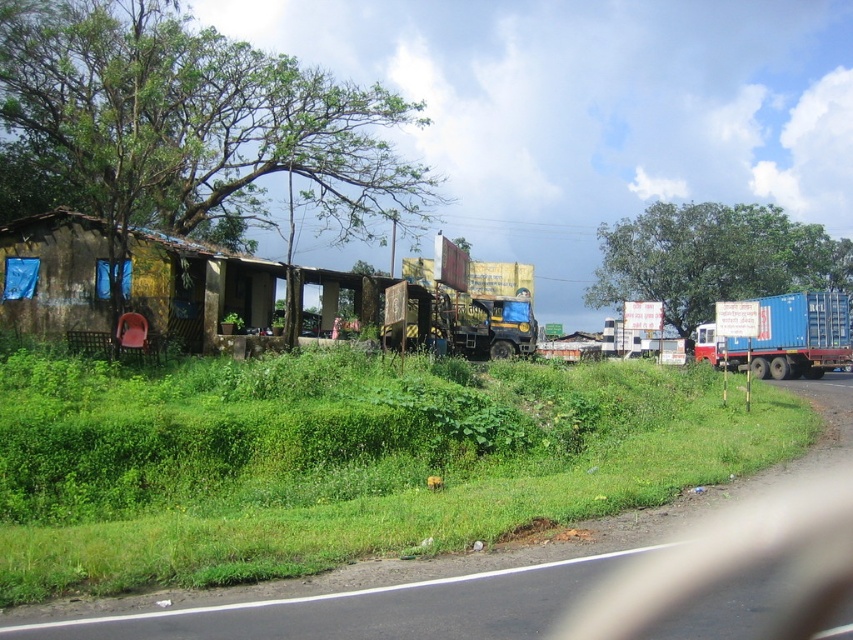
You are driving a delivery truck that is 22 feet long. You need to park your truck between the rusty corrugated metal hut at left and the yellow matte trailer truck at center. Is there enough space between them to park your truck without overlapping either vehicle?

The rusty corrugated metal hut at left and yellow matte trailer truck at center are 21.97 feet apart from each other. Since your truck is 22 feet long, there is not enough space to park between them without overlapping either vehicle.

You are standing at a point on the road and want to reach the red plastic chair outside the building. The coordinates of your current position are point (120,282). If the red plastic chair is 50 feet away from you, can you walk directly to it without any obstacles?

The distance of point (120,282) from viewer is 63.97 feet, so you are farther away from the red plastic chair than 50 feet. Therefore, you cannot walk directly to it within the 50 feet distance specified.

You are a gardener who needs to water the green grass at lower left using a hose that is 5 meters long. You are currently standing next to the rusty corrugated metal hut at left. Can you reach the grass without moving the hose? Please explain your reasoning.

The green grass at lower left and rusty corrugated metal hut at left are 7.54 meters apart. Since the hose is only 5 meters long, it is not long enough to reach the grass from the current position. You would need to move closer or use a longer hose.